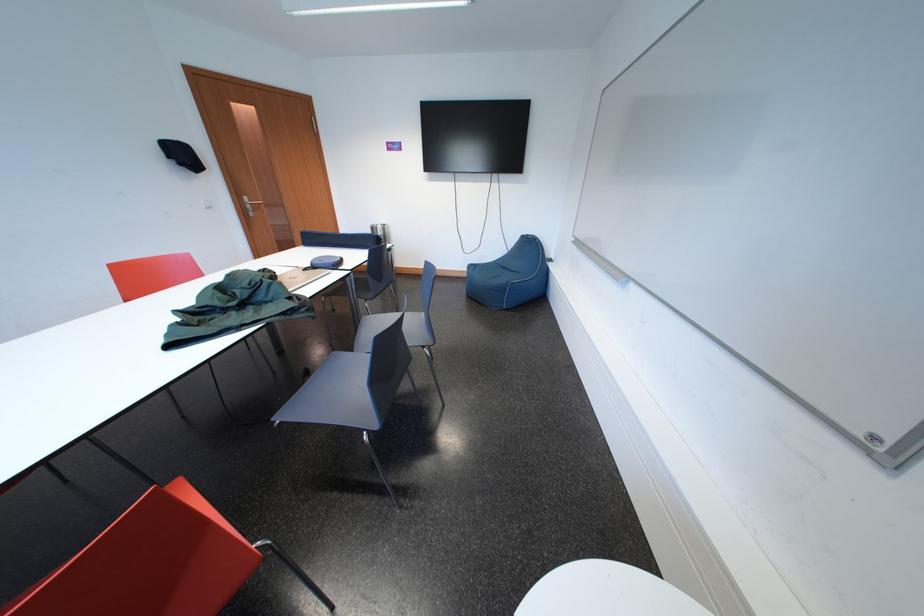
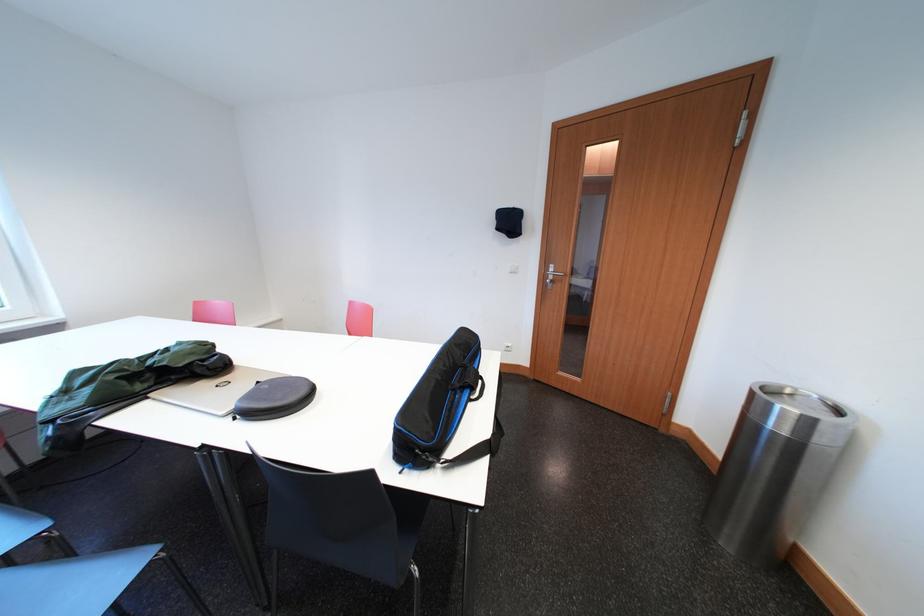
In the second image, find the point that corresponds to (x=189, y=168) in the first image.

(506, 233)